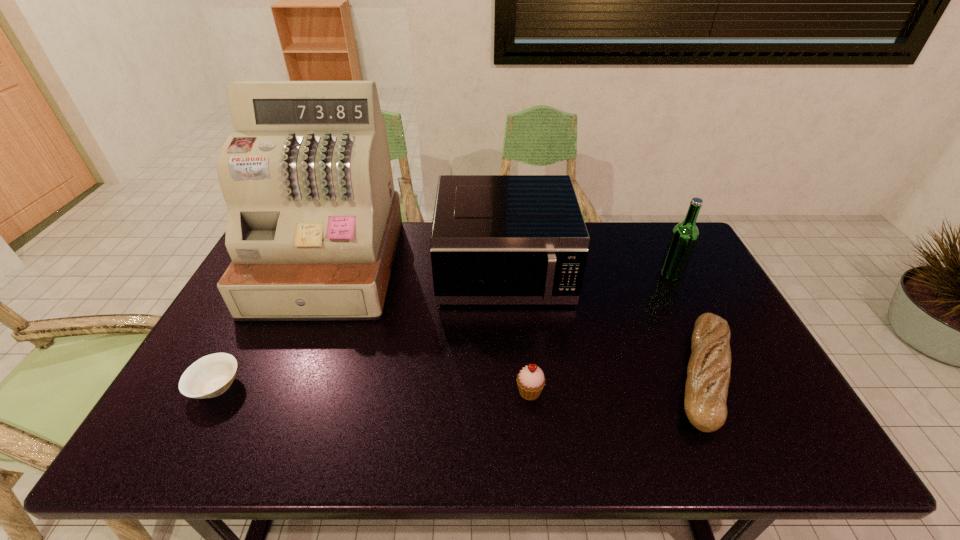
Locate an element on the screen. This screenshot has height=540, width=960. object at the near right corner is located at coordinates click(x=708, y=373).

The image size is (960, 540). What are the coordinates of `vacant region at the far edge of the desktop` in the screenshot? It's located at (625, 234).

The height and width of the screenshot is (540, 960). What are the coordinates of `blank space at the near edge of the desktop` in the screenshot? It's located at (386, 446).

Image resolution: width=960 pixels, height=540 pixels. Find the location of `free space at the left edge of the desktop`. free space at the left edge of the desktop is located at coordinates (219, 340).

Locate an element on the screen. free space at the right edge of the desktop is located at coordinates (754, 410).

This screenshot has height=540, width=960. I want to click on vacant space in between the shortest object and the microwave_oven, so click(360, 331).

The image size is (960, 540). I want to click on vacant space that is in between the microwave_oven and the bowl, so click(360, 331).

You are a GUI agent. You are given a task and a screenshot of the screen. Output one action in this format:
    pyautogui.click(x=<x>, y=<y>)
    Task: Click on the unoccupied position between the tallest object and the baguet
    
    Given the screenshot: What is the action you would take?
    pyautogui.click(x=516, y=320)

Locate an element on the screen. Image resolution: width=960 pixels, height=540 pixels. vacant space that's between the microwave_oven and the cupcake is located at coordinates (516, 333).

Where is `blank region between the beer bottle and the shortest object`? The width and height of the screenshot is (960, 540). blank region between the beer bottle and the shortest object is located at coordinates (444, 330).